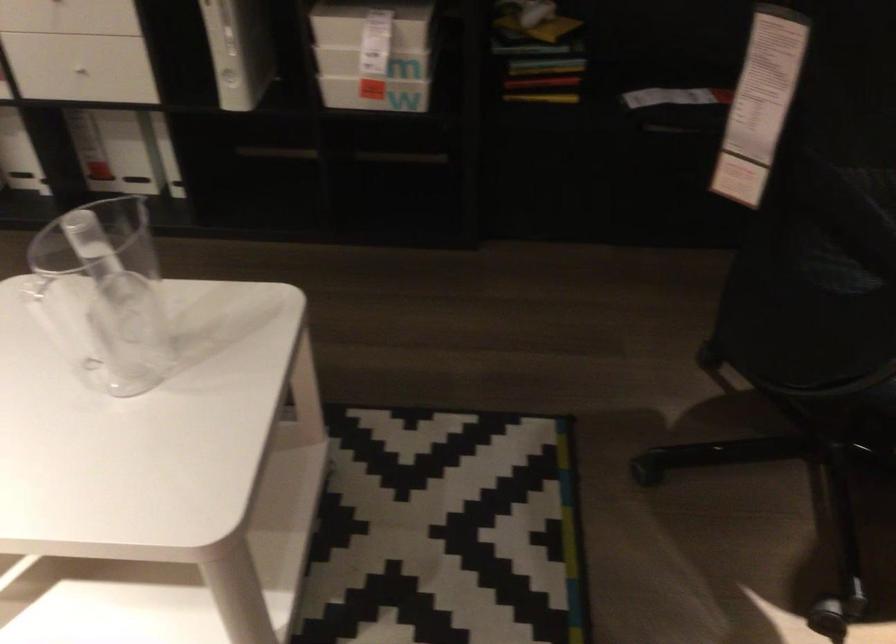
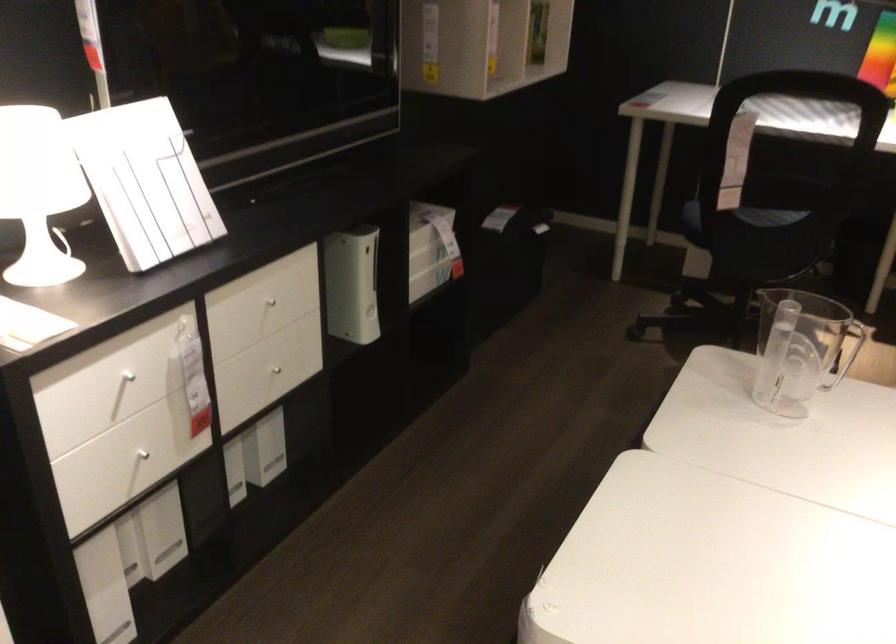
Find the pixel in the second image that matches the point at 782,245 in the first image.

(739, 218)